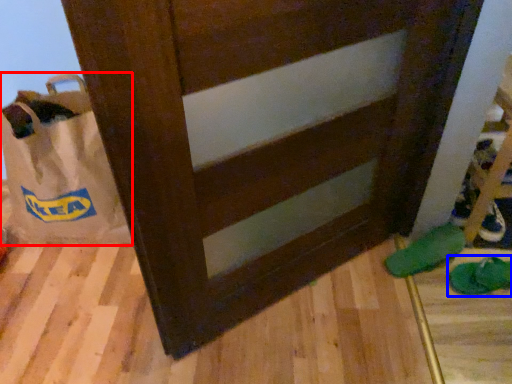
Question: Among these objects, which one is nearest to the camera, grocery bag (highlighted by a red box) or footwear (highlighted by a blue box)?

Choices:
 (A) grocery bag
 (B) footwear

Answer: (A)